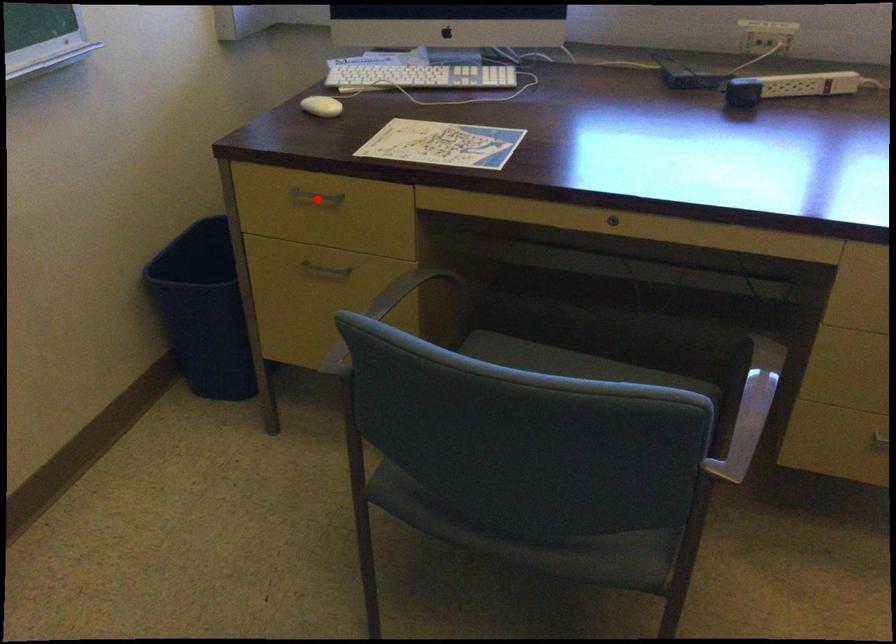
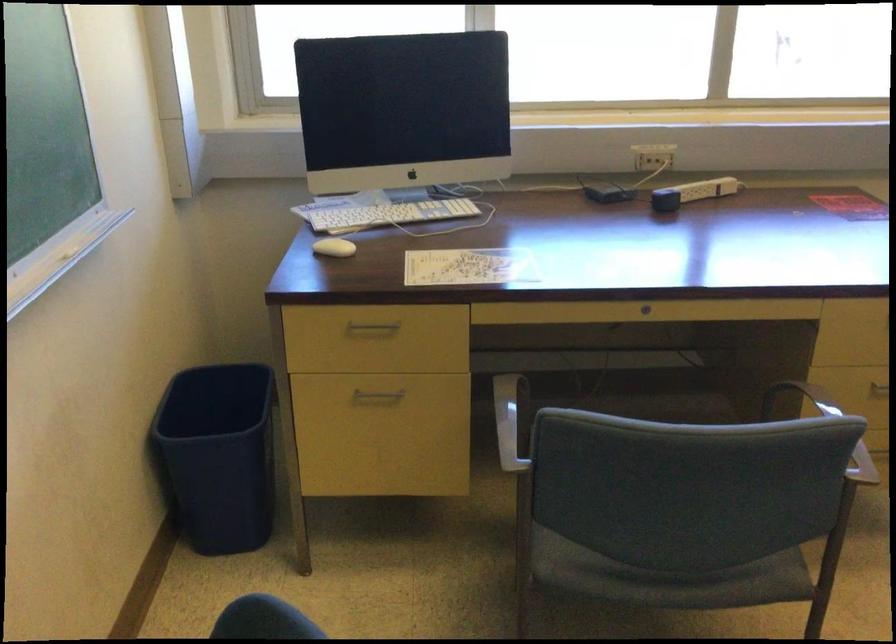
Locate, in the second image, the point that corresponds to the highlighted location in the first image.

(373, 327)